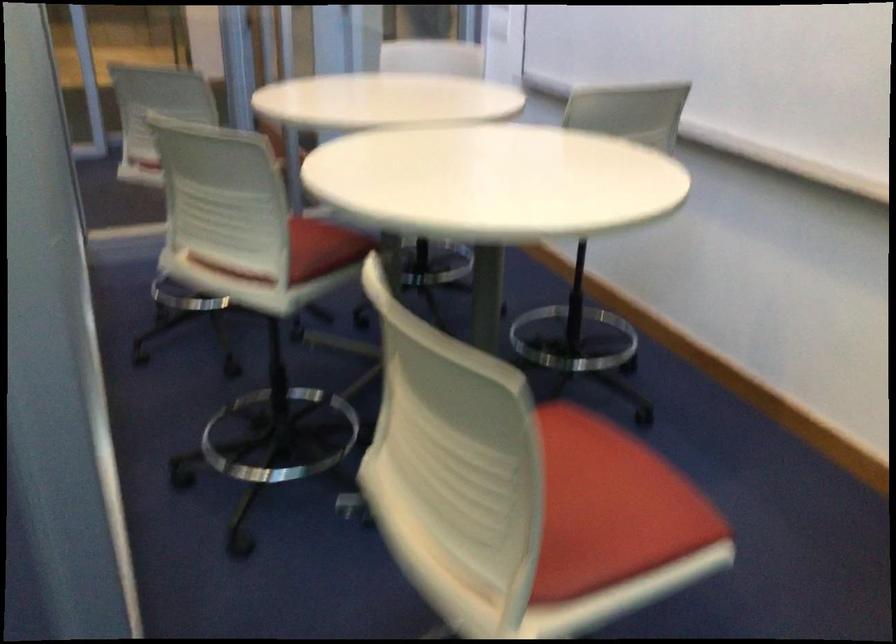
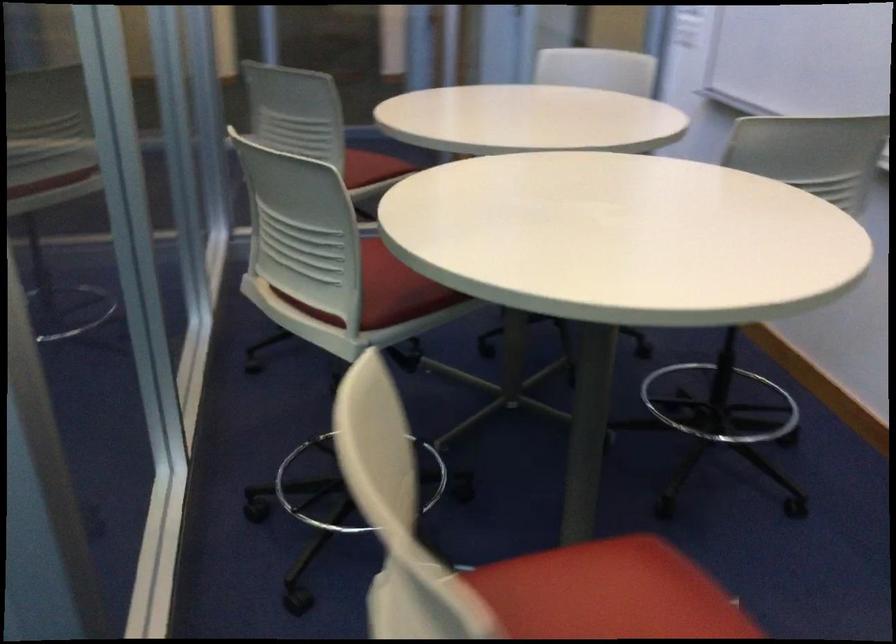
Locate, in the second image, the point that corresponds to pixel 540 438 in the first image.

(608, 592)